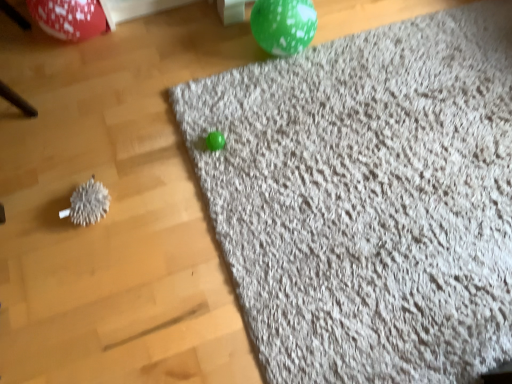
Question: From the image's perspective, is white fuzzy ball at left above or below green speckled balloon at upper center, marked as the first balloon in a right-to-left arrangement?

Choices:
 (A) above
 (B) below

Answer: (B)

Question: From their relative heights in the image, would you say white fuzzy ball at left is taller or shorter than green speckled balloon at upper center, which appears as the second balloon when viewed from the left?

Choices:
 (A) tall
 (B) short

Answer: (B)

Question: Which is nearer to the shiny red balloon at upper left, marked as the second balloon in a right-to-left arrangement?

Choices:
 (A) green speckled balloon at upper center, which appears as the second balloon when viewed from the left
 (B) gray shaggy rug at upper right
 (C) white fuzzy ball at left

Answer: (C)

Question: Estimate the real-world distances between objects in this image. Which object is farther from the white fuzzy ball at left?

Choices:
 (A) gray shaggy rug at upper right
 (B) green speckled balloon at upper center, which appears as the second balloon when viewed from the left
 (C) shiny red balloon at upper left, which is counted as the first balloon, starting from the left

Answer: (B)